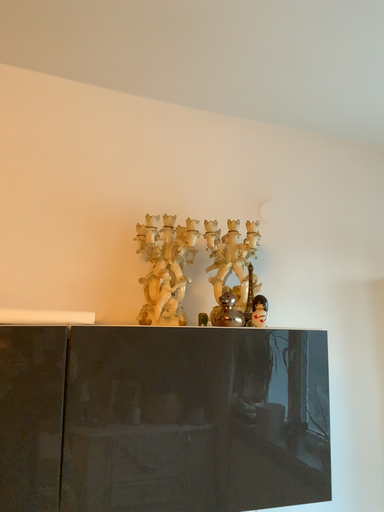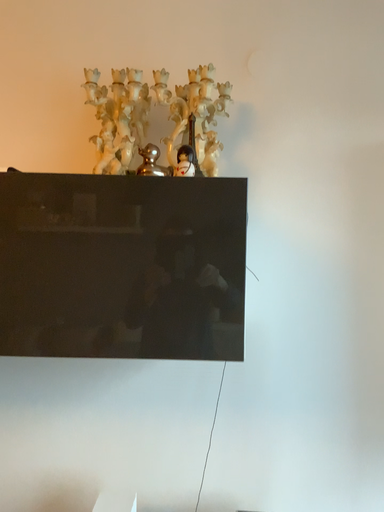
Question: Which way did the camera rotate in the video?

Choices:
 (A) rotated upward
 (B) rotated downward

Answer: (B)